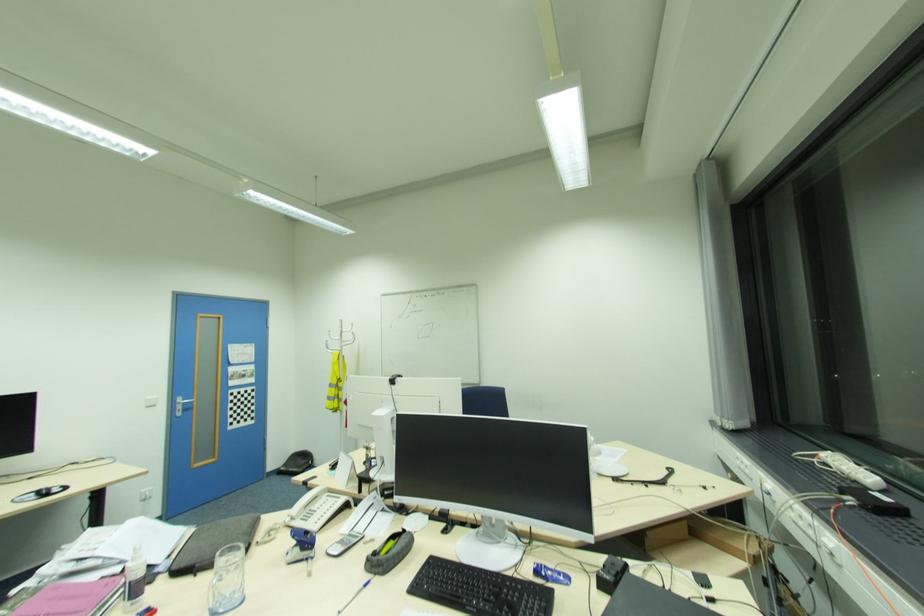
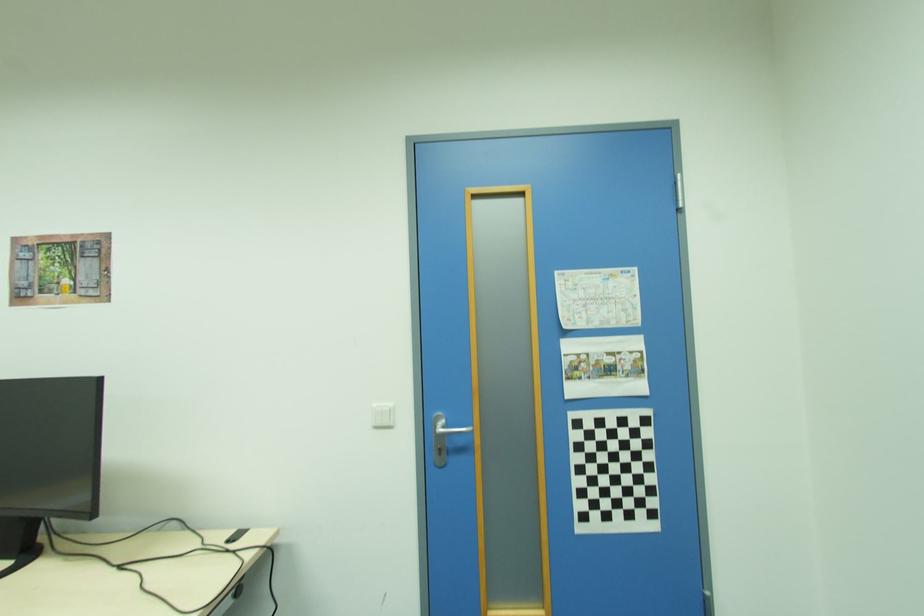
The point at (236, 376) is marked in the first image. Where is the corresponding point in the second image?

(579, 369)